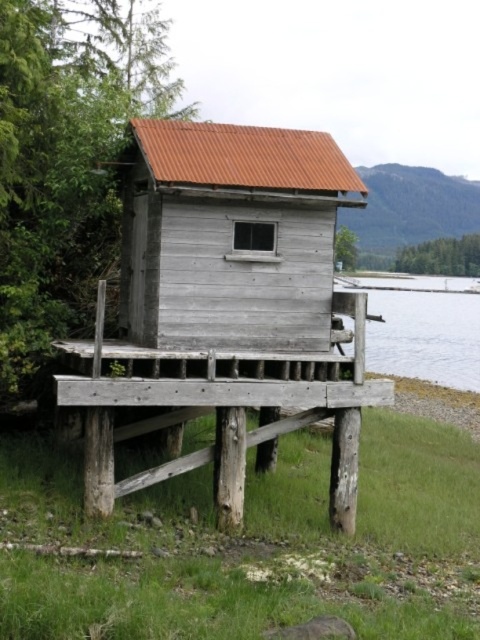
Consider the image. Is weathered wood hut at center bigger than clear water at lower right?

No, weathered wood hut at center is not bigger than clear water at lower right.

Does weathered wood hut at center appear on the right side of clear water at lower right?

In fact, weathered wood hut at center is to the left of clear water at lower right.

Describe the element at coordinates (228, 305) in the screenshot. The image size is (480, 640). I see `weathered wood hut at center` at that location.

In order to click on weathered wood hut at center in this screenshot , I will do `click(228, 305)`.

Is weathered wood cabin at center smaller than clear water at lower right?

Yes.

Consider the image. Who is more distant from viewer, (308,160) or (460,339)?

Point (460,339)

Who is more forward, (339, 186) or (454, 316)?

Point (339, 186)

Identify the location of weathered wood cabin at center. The height and width of the screenshot is (640, 480). (229, 234).

From the picture: Is weathered wood hut at center in front of weathered wood cabin at center?

Yes, weathered wood hut at center is closer to the viewer.

Is weathered wood hut at center to the right of weathered wood cabin at center from the viewer's perspective?

Correct, you'll find weathered wood hut at center to the right of weathered wood cabin at center.

Who is more forward, (285, 298) or (121, 246)?

Point (285, 298) is in front.

Locate an element on the screen. This screenshot has width=480, height=640. weathered wood hut at center is located at coordinates (228, 305).